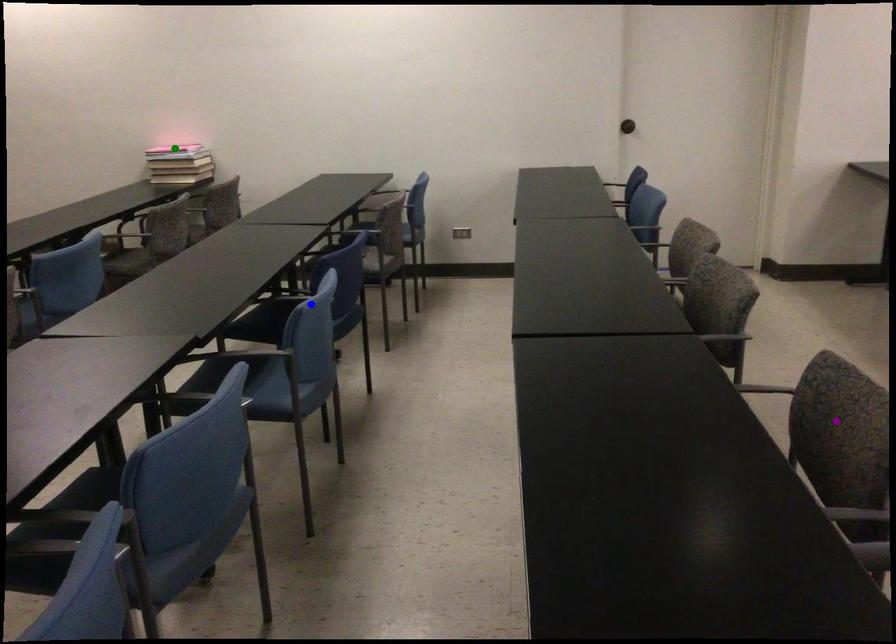
Order these from nearest to farthest:
- green point
- purple point
- blue point

purple point < blue point < green point